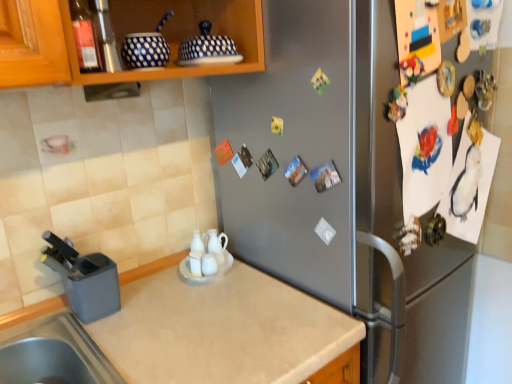
The width and height of the screenshot is (512, 384). In order to click on vacant space that's between gray plastic knife block at lower left, the first appliance in the bottom-to-top sequence, and white glossy tea pot at center in this screenshot , I will do `click(148, 289)`.